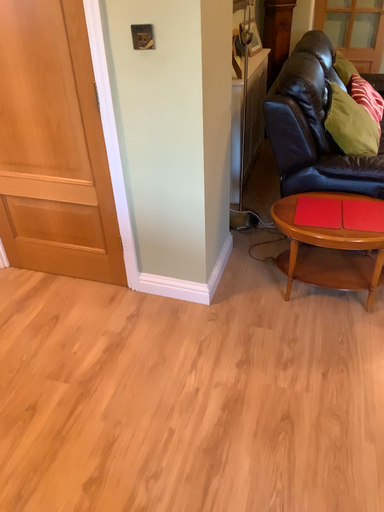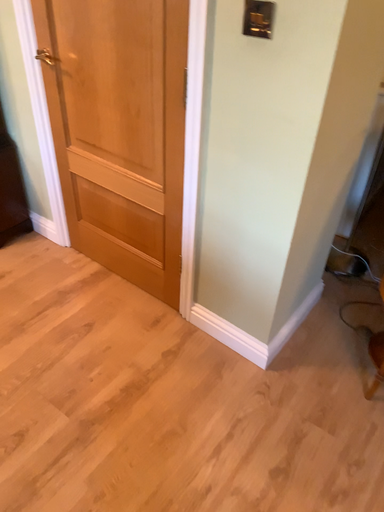
Question: How did the camera likely rotate when shooting the video?

Choices:
 (A) rotated left
 (B) rotated right

Answer: (A)